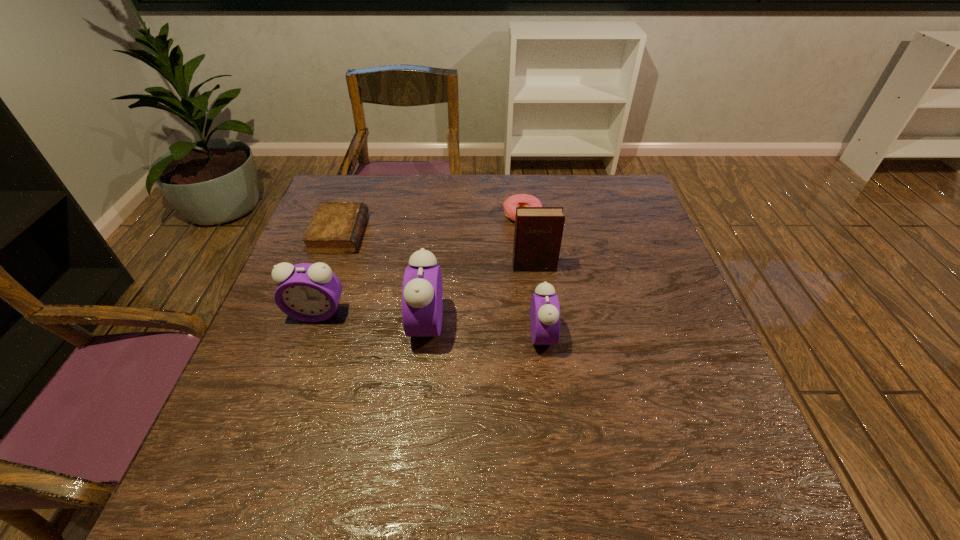
The width and height of the screenshot is (960, 540). I want to click on the leftmost alarm clock, so click(x=308, y=292).

Find the location of a particular element. the second tallest alarm clock is located at coordinates (308, 292).

You are a GUI agent. You are given a task and a screenshot of the screen. Output one action in this format:
    pyautogui.click(x=<x>, y=<y>)
    Task: Click on the second alarm clock from left to right
    This screenshot has height=540, width=960.
    Given the screenshot: What is the action you would take?
    pyautogui.click(x=422, y=292)

This screenshot has width=960, height=540. Find the location of `the third shortest object`. the third shortest object is located at coordinates (544, 309).

The image size is (960, 540). I want to click on the shortest alarm clock, so click(544, 309).

I want to click on doughnut, so click(x=518, y=200).

Identify the location of the shorter diary. This screenshot has width=960, height=540. (336, 227).

In order to click on the farther diary in this screenshot , I will do `click(336, 227)`.

Where is `the right diary`? This screenshot has height=540, width=960. the right diary is located at coordinates (538, 231).

I want to click on the third farthest object, so click(538, 231).